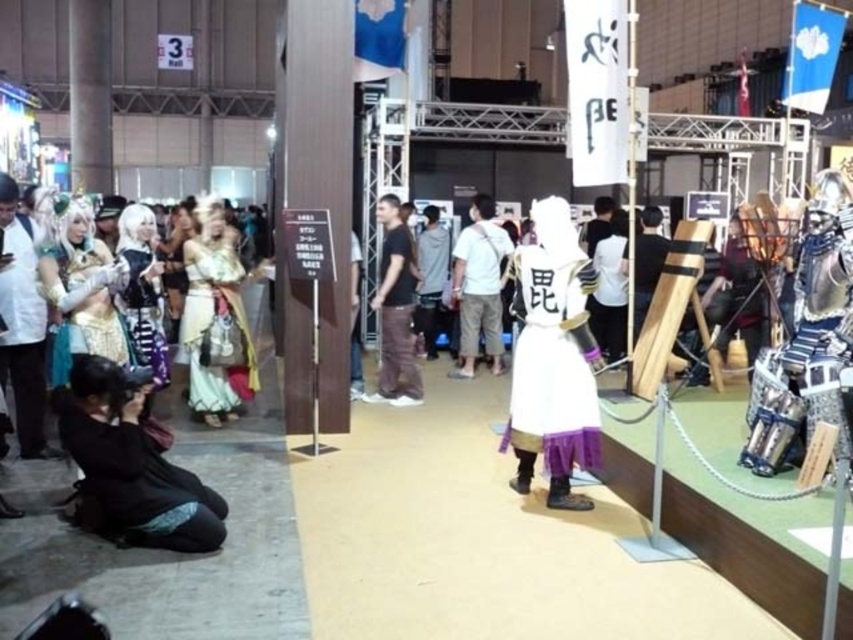
Does white lace dress at center appear on the left side of light gray cotton shirt at center?

Indeed, white lace dress at center is positioned on the left side of light gray cotton shirt at center.

Is white lace dress at center to the right of light gray cotton shirt at center from the viewer's perspective?

In fact, white lace dress at center is to the left of light gray cotton shirt at center.

Who is more forward, (189,257) or (444,257)?

Point (189,257) is more forward.

Identify the location of white lace dress at center. tap(216, 317).

Is black fabric outfit at lower left above black cotton t-shirt at center?

Incorrect, black fabric outfit at lower left is not positioned above black cotton t-shirt at center.

Locate an element on the screen. black fabric outfit at lower left is located at coordinates (131, 467).

Is white matte dress at center below white cotton shirt at center?

Indeed, white matte dress at center is positioned under white cotton shirt at center.

Can you confirm if white matte dress at center is smaller than white cotton shirt at center?

Yes.

You are a GUI agent. You are given a task and a screenshot of the screen. Output one action in this format:
    pyautogui.click(x=<x>, y=<y>)
    Task: Click on the white matte dress at center
    This screenshot has width=853, height=640.
    Given the screenshot: What is the action you would take?
    pyautogui.click(x=550, y=358)